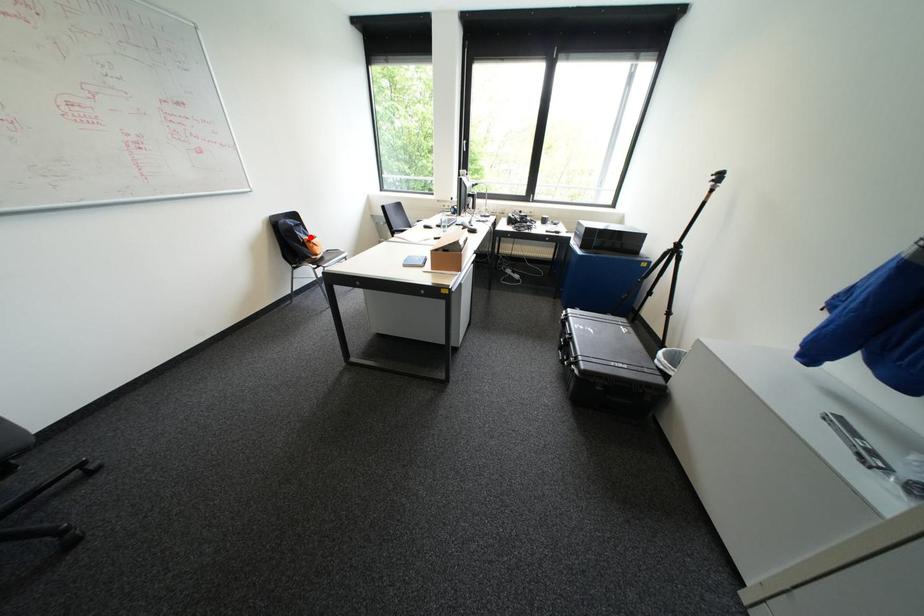
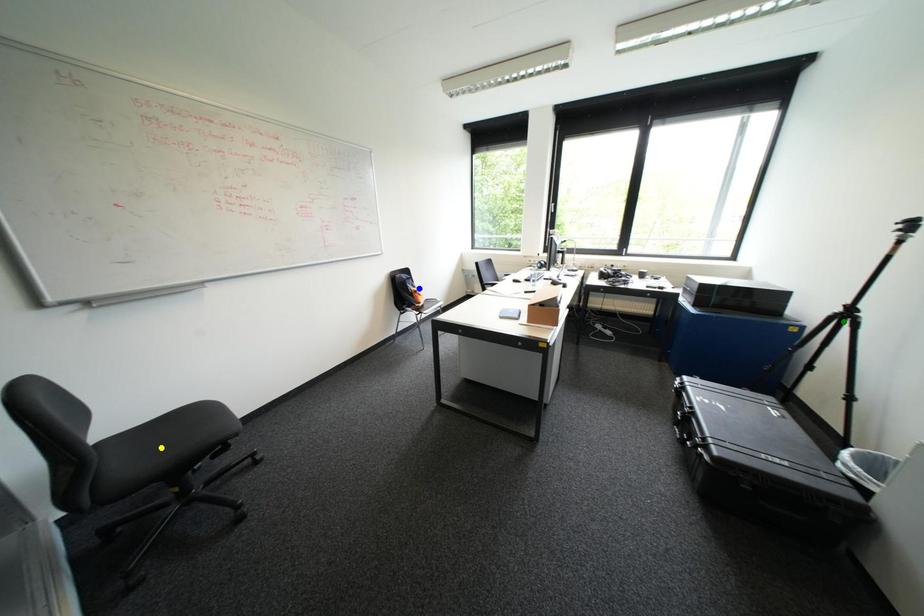
Question: I am providing you with two images of the same scene from different viewpoints. A red point is marked on the first image. You are given multiple points on the second image. Which point in image 2 is actually the same real-world point as the red point in image 1?

Choices:
 (A) blue point
 (B) green point
 (C) yellow point

Answer: (A)